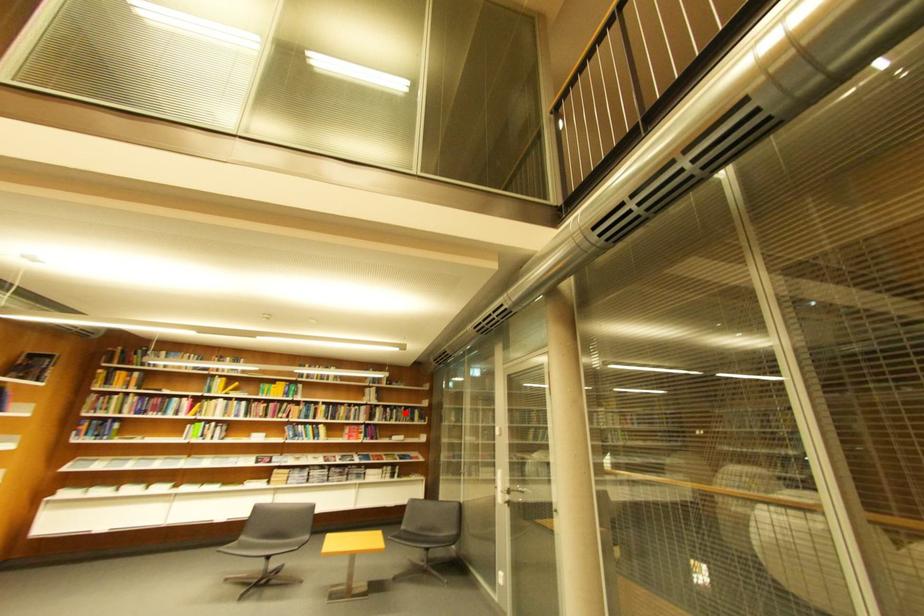
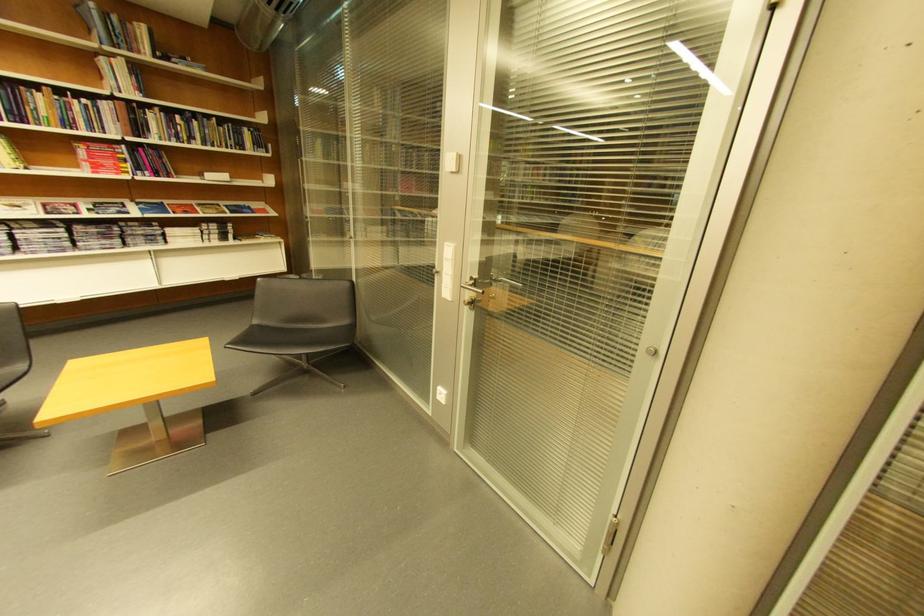
Question: I am providing you with two images of the same scene from different viewpoints. In image1, a red point is highlighted. Considering the same 3D point in image2, which of the following is correct?

Choices:
 (A) It is closer
 (B) It is farther

Answer: (A)